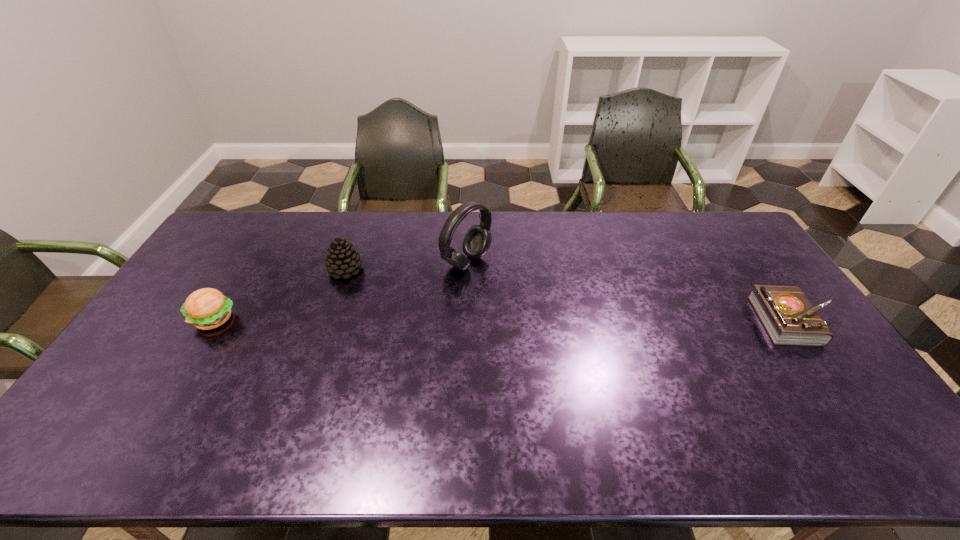
Identify the location of hamburger. (207, 308).

What are the coordinates of `the leftmost object` in the screenshot? It's located at (207, 308).

Where is `the shortest object`? The image size is (960, 540). the shortest object is located at coordinates (789, 318).

Identify the location of the rightmost object. (789, 318).

Find the location of a particular element. the second object from left to right is located at coordinates (342, 259).

You are a GUI agent. You are given a task and a screenshot of the screen. Output one action in this format:
    pyautogui.click(x=<x>, y=<y>)
    Task: Click on the second tallest object
    Image resolution: width=960 pixels, height=540 pixels.
    Given the screenshot: What is the action you would take?
    pyautogui.click(x=342, y=259)

Locate an element on the screen. The height and width of the screenshot is (540, 960). headset is located at coordinates (477, 240).

At what (x,y) coordinates should I click in order to perform the action: click on the third object from left to right. Please return your answer as a coordinate pair (x, y). Looking at the image, I should click on (477, 240).

At what (x,y) coordinates should I click in order to perform the action: click on vacant space situated 0.350m on the right of the leftmost object. Please return your answer as a coordinate pair (x, y). The width and height of the screenshot is (960, 540). Looking at the image, I should click on (355, 319).

Locate an element on the screen. The image size is (960, 540). vacant space located on the back of the diary is located at coordinates (767, 285).